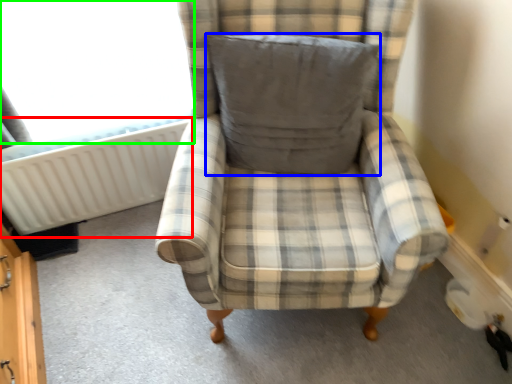
Question: Based on their relative distances, which object is nearer to radiator (highlighted by a red box)? Choose from pillow (highlighted by a blue box) and window screen (highlighted by a green box).

Choices:
 (A) pillow
 (B) window screen

Answer: (B)